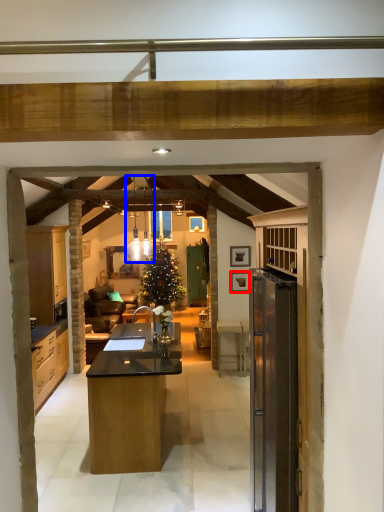
Question: Which of the following is the closest to the observer, picture frame (highlighted by a red box) or lamp (highlighted by a blue box)?

Choices:
 (A) picture frame
 (B) lamp

Answer: (B)